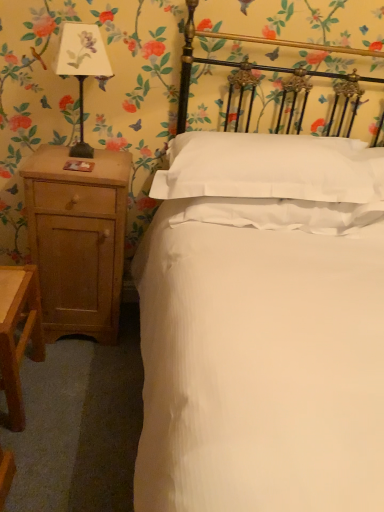
Find the location of a particular element. This screenshot has width=384, height=512. vacant region above light brown wood nightstand at left (from a real-world perspective) is located at coordinates (91, 163).